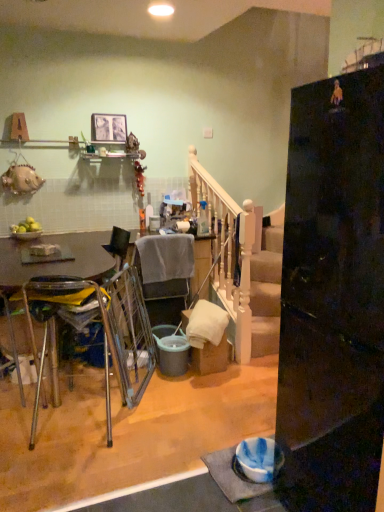
Where is `matte glass picture frame at upper center`? matte glass picture frame at upper center is located at coordinates (108, 128).

At what (x,y) coordinates should I click in order to perform the action: click on matte gray bucket at center. Please return your answer as a coordinate pair (x, y). Image resolution: width=384 pixels, height=512 pixels. Looking at the image, I should click on point(171,350).

Locate an element on the screen. Image resolution: width=384 pixels, height=512 pixels. gray fabric chair at center, which is the second chair from front to back is located at coordinates (165, 275).

What do you see at coordinates (129, 334) in the screenshot? I see `metallic silver swivel chair at center` at bounding box center [129, 334].

I want to click on matte glass picture frame at upper center, so click(108, 128).

From the image's perspective, which is below, glossy black refrigerator at right or translucent glass bottle at upper center?

glossy black refrigerator at right.

Is glossy black refrigerator at right taller or shorter than translucent glass bottle at upper center?

In the image, glossy black refrigerator at right appears to be taller than translucent glass bottle at upper center.

Is glossy black refrigerator at right further to camera compared to translucent glass bottle at upper center?

No, glossy black refrigerator at right is closer to the camera.

Are glossy black refrigerator at right and translucent glass bottle at upper center far apart?

That's right, there is a large distance between glossy black refrigerator at right and translucent glass bottle at upper center.

Which object is further away from the camera taking this photo, matte glass picture frame at upper center or gray fabric chair at center, which is the second chair from front to back?

matte glass picture frame at upper center is behind.

Measure the distance from matte glass picture frame at upper center to gray fabric chair at center, which is the second chair from front to back.

matte glass picture frame at upper center and gray fabric chair at center, which is the second chair from front to back, are 1.18 meters apart from each other.

From the picture: Is matte glass picture frame at upper center looking in the opposite direction of gray fabric chair at center, the 1th chair viewed from the back?

No.

From the picture: Which point is more forward, [92,121] or [163,286]?

The point [163,286] is closer to the camera.

Where is `chair lying behind the metallic silver swivel chair at center`? chair lying behind the metallic silver swivel chair at center is located at coordinates (165, 275).

Considering the sizes of objects metallic silver swivel chair at center and gray fabric chair at center, the 1th chair viewed from the back, in the image provided, who is bigger, metallic silver swivel chair at center or gray fabric chair at center, the 1th chair viewed from the back,?

Bigger between the two is metallic silver swivel chair at center.

Are metallic silver swivel chair at center and gray fabric chair at center, which is the first chair from right to left, located far from each other?

No, metallic silver swivel chair at center is not far away from gray fabric chair at center, which is the first chair from right to left.

From a real-world perspective, between metallic silver swivel chair at center and gray fabric chair at center, acting as the second chair starting from the left, who is vertically lower?

metallic silver swivel chair at center is physically lower.

How many degrees apart are the facing directions of glossy black refrigerator at right and matte gray bucket at center?

The facing directions of glossy black refrigerator at right and matte gray bucket at center are 90.8 degrees apart.

Based on their sizes in the image, would you say glossy black refrigerator at right is bigger or smaller than matte gray bucket at center?

In the image, glossy black refrigerator at right appears to be larger than matte gray bucket at center.

Is glossy black refrigerator at right at the right side of matte gray bucket at center?

Yes, glossy black refrigerator at right is to the right of matte gray bucket at center.

Considering the points (335, 372) and (177, 373), which point is in front, point (335, 372) or point (177, 373)?

The point (335, 372) is closer to the camera.

Is gray fabric chair at center, acting as the second chair starting from the left, facing towards matte glass picture frame at upper center?

No, gray fabric chair at center, acting as the second chair starting from the left, does not turn towards matte glass picture frame at upper center.

Considering the sizes of gray fabric chair at center, acting as the second chair starting from the left, and matte glass picture frame at upper center in the image, is gray fabric chair at center, acting as the second chair starting from the left, taller or shorter than matte glass picture frame at upper center?

Considering their sizes, gray fabric chair at center, acting as the second chair starting from the left, has more height than matte glass picture frame at upper center.

Who is smaller, gray fabric chair at center, which is the first chair from right to left, or matte glass picture frame at upper center?

Smaller between the two is matte glass picture frame at upper center.

Which of these two, matte gray bucket at center or metallic silver chair at left, the 1th chair from the front, stands taller?

Standing taller between the two is metallic silver chair at left, the 1th chair from the front.

From the image's perspective, who appears lower, matte gray bucket at center or metallic silver chair at left, the 1th chair from the front?

matte gray bucket at center.

Is matte gray bucket at center positioned beyond the bounds of metallic silver chair at left, the 1th chair from the front?

matte gray bucket at center is positioned outside metallic silver chair at left, the 1th chair from the front.

Is matte gray bucket at center in contact with metallic silver chair at left, placed as the 2th chair when sorted from back to front?

No, matte gray bucket at center is not touching metallic silver chair at left, placed as the 2th chair when sorted from back to front.

Looking at this image, can you confirm if translucent glass bottle at upper center is bigger than white wooden rail at center?

Actually, translucent glass bottle at upper center might be smaller than white wooden rail at center.

What's the angular difference between translucent glass bottle at upper center and white wooden rail at center's facing directions?

There is a 89.1-degree angle between the facing directions of translucent glass bottle at upper center and white wooden rail at center.

Is translucent glass bottle at upper center in front of white wooden rail at center?

No, it is behind white wooden rail at center.

Identify the location of rail in front of the translucent glass bottle at upper center. (240, 267).

Where is `refrigerator in front of the translucent glass bottle at upper center`? The width and height of the screenshot is (384, 512). refrigerator in front of the translucent glass bottle at upper center is located at coordinates (333, 297).

There is a gray fabric chair at center, acting as the second chair starting from the left. Where is `picture frame above it (from a real-world perspective)`? picture frame above it (from a real-world perspective) is located at coordinates (108, 128).

From the image, which object appears to be farther from metallic silver chair at left, placed as the 2th chair when sorted from back to front, white wooden rail at center or metallic silver swivel chair at center?

white wooden rail at center.

Considering their positions, is matte gray bucket at center positioned closer to translucent glass bottle at upper center than glossy black refrigerator at right?

Based on the image, matte gray bucket at center appears to be nearer to translucent glass bottle at upper center.

Which object lies further to the anchor point gray fabric chair at center, acting as the second chair starting from the left, metallic silver chair at left, placed as the 2th chair when sorted from back to front, or translucent glass bottle at upper center?

metallic silver chair at left, placed as the 2th chair when sorted from back to front.

Based on their spatial positions, is translucent glass bottle at upper center or metallic silver chair at left, placed as the 2th chair when sorted from back to front, closer to matte glass picture frame at upper center?

translucent glass bottle at upper center lies closer to matte glass picture frame at upper center than the other object.

Based on the photo, when comparing their distances from metallic silver chair at left, which is the second chair in right-to-left order, does metallic silver swivel chair at center or translucent glass bottle at upper center seem closer?

Based on the image, metallic silver swivel chair at center appears to be nearer to metallic silver chair at left, which is the second chair in right-to-left order.

Looking at the image, which one is located further to metallic silver chair at left, the 1th chair from the front, translucent glass bottle at upper center or glossy black refrigerator at right?

translucent glass bottle at upper center is positioned further to the anchor metallic silver chair at left, the 1th chair from the front.

Considering their positions, is metallic silver chair at left, which is the second chair in right-to-left order, positioned further to matte gray bucket at center than gray fabric chair at center, acting as the second chair starting from the left?

metallic silver chair at left, which is the second chair in right-to-left order, is positioned further to the anchor matte gray bucket at center.

From the image, which object appears to be nearer to white wooden rail at center, matte glass picture frame at upper center or translucent glass bottle at upper center?

translucent glass bottle at upper center is closer to white wooden rail at center.

The image size is (384, 512). Identify the location of bottle between matte glass picture frame at upper center and gray fabric chair at center, acting as the second chair starting from the left, vertically. (203, 219).

Locate an element on the screen. swivel chair between metallic silver chair at left, placed as the 2th chair when sorted from back to front, and matte gray bucket at center, along the z-axis is located at coordinates (129, 334).

At what (x,y) coordinates should I click in order to perform the action: click on rail between matte glass picture frame at upper center and metallic silver chair at left, the 1th chair from the front, in the vertical direction. Please return your answer as a coordinate pair (x, y). Image resolution: width=384 pixels, height=512 pixels. Looking at the image, I should click on (240, 267).

Find the location of a particular element. swivel chair between glossy black refrigerator at right and matte gray bucket at center from front to back is located at coordinates (129, 334).